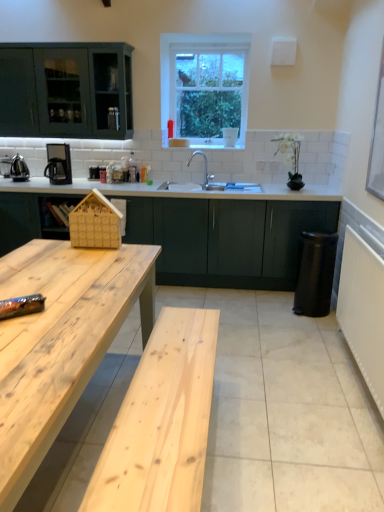
Question: Is wooden house at center positioned behind matte black coffee machine at left?

Choices:
 (A) yes
 (B) no

Answer: (B)

Question: Can you confirm if wooden house at center is thinner than matte black coffee machine at left?

Choices:
 (A) no
 (B) yes

Answer: (B)

Question: Is wooden house at center bigger than matte black coffee machine at left?

Choices:
 (A) yes
 (B) no

Answer: (B)

Question: Does wooden house at center touch matte black coffee machine at left?

Choices:
 (A) no
 (B) yes

Answer: (A)

Question: Is wooden house at center at the left side of matte black coffee machine at left?

Choices:
 (A) yes
 (B) no

Answer: (B)

Question: From a real-world perspective, is polished stainless steel kettle at left physically located above or below white textured radiator at right?

Choices:
 (A) below
 (B) above

Answer: (B)

Question: Does point (13, 180) appear closer or farther from the camera than point (374, 377)?

Choices:
 (A) closer
 (B) farther

Answer: (B)

Question: Which is correct: polished stainless steel kettle at left is inside white textured radiator at right, or outside of it?

Choices:
 (A) inside
 (B) outside

Answer: (B)

Question: Considering the positions of polished stainless steel kettle at left and white textured radiator at right in the image, is polished stainless steel kettle at left wider or thinner than white textured radiator at right?

Choices:
 (A) wide
 (B) thin

Answer: (A)

Question: Is point (251, 243) closer or farther from the camera than point (188, 50)?

Choices:
 (A) farther
 (B) closer

Answer: (B)

Question: From a real-world perspective, relative to clear glass window at upper center, is dark green matte cabinet at center vertically above or below?

Choices:
 (A) below
 (B) above

Answer: (A)

Question: In the image, is dark green matte cabinet at center positioned in front of or behind clear glass window at upper center?

Choices:
 (A) behind
 (B) front

Answer: (B)

Question: Do you think dark green matte cabinet at center is within clear glass window at upper center, or outside of it?

Choices:
 (A) inside
 (B) outside

Answer: (B)

Question: From the image's perspective, is matte black coffee machine at left above or below natural wood table at lower left?

Choices:
 (A) above
 (B) below

Answer: (A)

Question: Is matte black coffee machine at left in front of or behind natural wood table at lower left in the image?

Choices:
 (A) front
 (B) behind

Answer: (B)